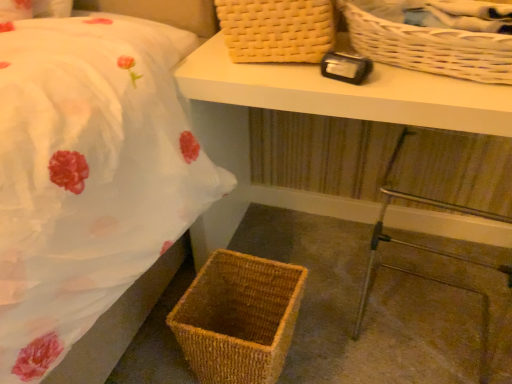
Where is `vacant space that is to the left of brown woven picnic basket at lower left, the 1th picnic basket ordered from the bottom`? vacant space that is to the left of brown woven picnic basket at lower left, the 1th picnic basket ordered from the bottom is located at coordinates (151, 354).